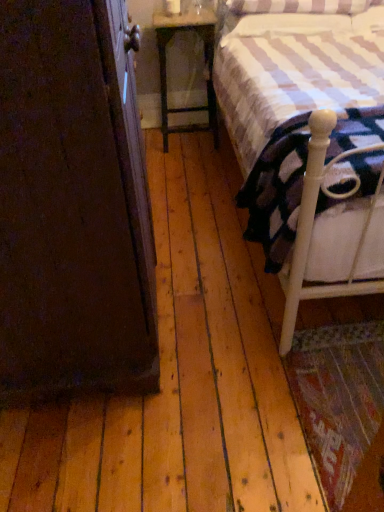
Question: From their relative heights in the image, would you say white soft mattress at right is taller or shorter than dark wood armoire at left?

Choices:
 (A) short
 (B) tall

Answer: (A)

Question: From the image's perspective, relative to dark wood armoire at left, is white soft mattress at right above or below?

Choices:
 (A) above
 (B) below

Answer: (B)

Question: Which object is positioned closest to the dark wood armoire at left?

Choices:
 (A) white wood bed at right
 (B) wooden nightstand at center
 (C) white soft mattress at right

Answer: (C)

Question: Which object is positioned closest to the white soft mattress at right?

Choices:
 (A) white wood bed at right
 (B) dark wood armoire at left
 (C) wooden nightstand at center

Answer: (A)